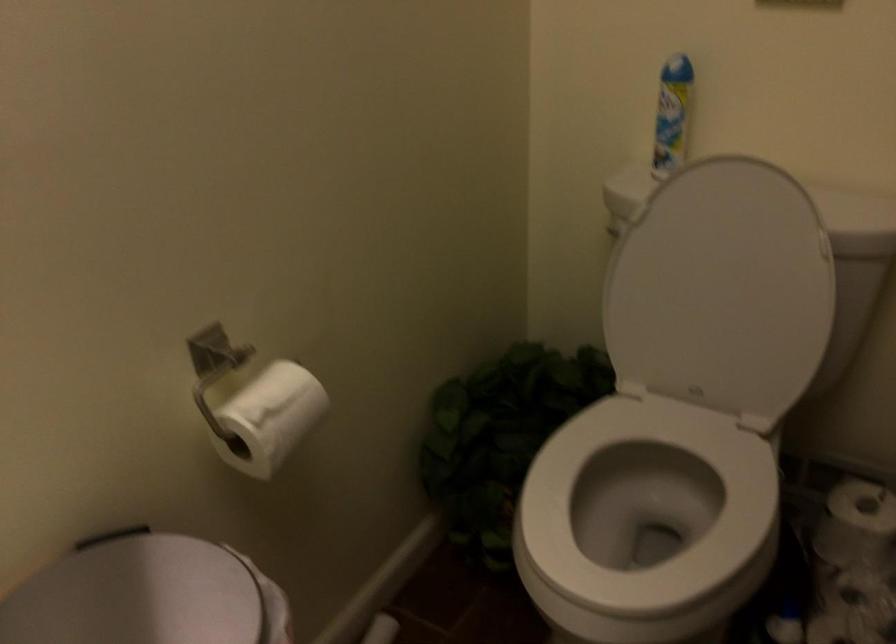
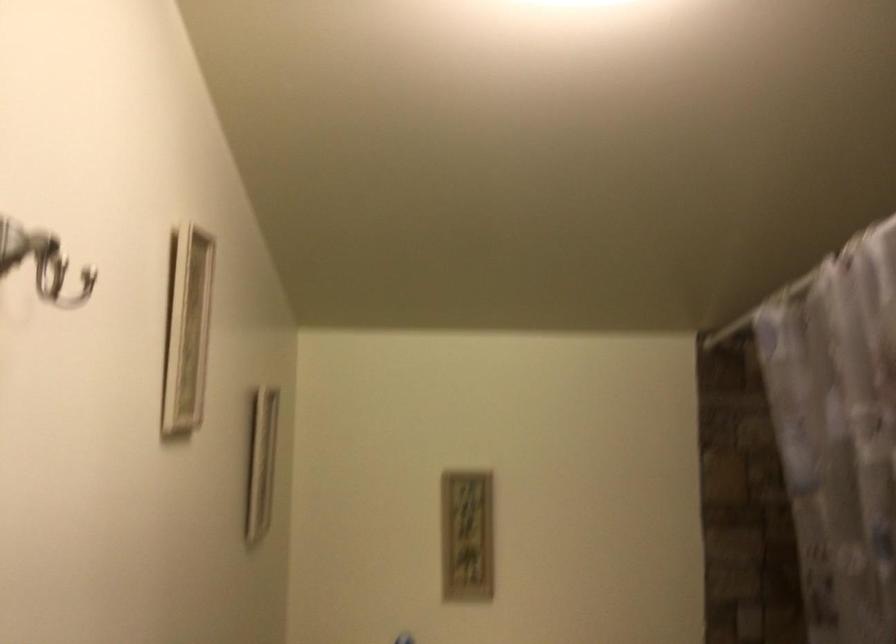
The images are taken continuously from a first-person perspective. In which direction is your viewpoint rotating?

The camera's rotation is toward right-up.